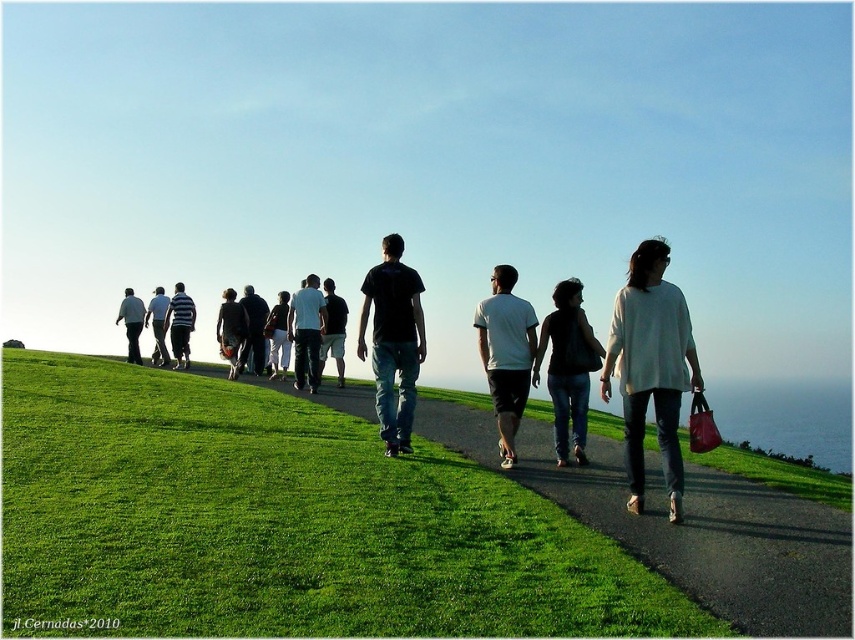
Question: Which object is positioned closest to the white matte t-shirt at center?

Choices:
 (A) green grass at center
 (B) dark gray shirt at center
 (C) striped cotton shirt at center

Answer: (A)

Question: Among these objects, which one is nearest to the camera?

Choices:
 (A) white matte sweater at center-right
 (B) dark gray shirt at center
 (C) dark gray hoodie at center
 (D) white matte t-shirt at center

Answer: (A)

Question: Is dark blue jeans at center smaller than dark gray pants at left?

Choices:
 (A) no
 (B) yes

Answer: (A)

Question: Does black matte shirt at center have a larger size compared to dark gray sweater at center?

Choices:
 (A) no
 (B) yes

Answer: (A)

Question: Can you confirm if green grass at center is bigger than dark blue jeans at center?

Choices:
 (A) yes
 (B) no

Answer: (A)

Question: Which of the following is the closest to the observer?

Choices:
 (A) (342, 369)
 (B) (234, 321)
 (C) (127, 356)

Answer: (A)